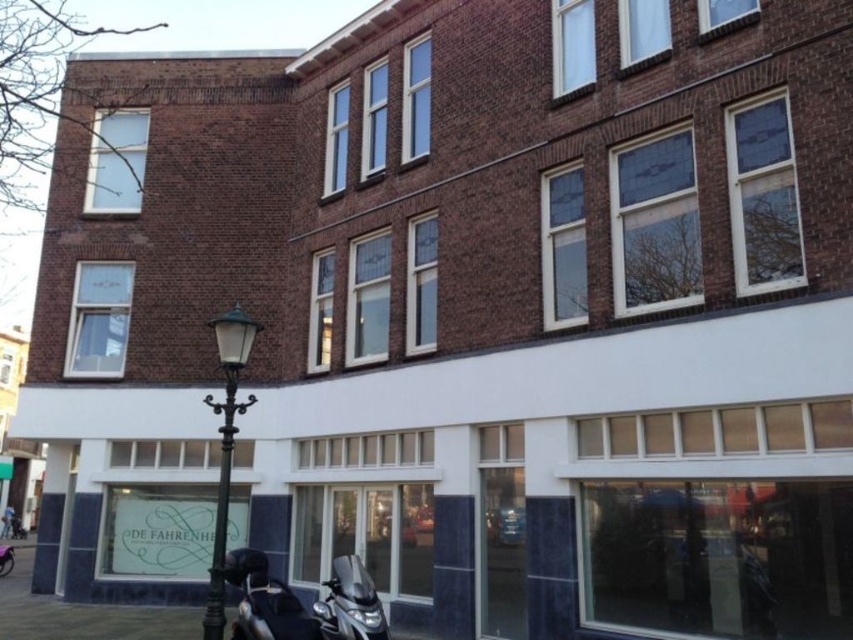
You are a delivery person standing at the entrance of the building. You need to park your motorcycle exactly 8 feet away from the black wrought iron streetlight at lower left. Can you park your shiny metallic motorcycle at lower center in the spot shown?

The black wrought iron streetlight at lower left is 7.76 feet away from the shiny metallic motorcycle at lower center. Since 7.76 feet is less than 8 feet, parking the shiny metallic motorcycle at lower center there would be too close to the streetlight. You need to move it further away by approximately 0.24 feet to meet the 8 feet requirement.

You are a delivery person who needs to park your shiny metallic motorcycle at lower center near the black wrought iron streetlight at lower left. Considering their heights, which object is shorter and would allow you to park without blocking the streetlight?

The black wrought iron streetlight at lower left is shorter than the shiny metallic motorcycle at lower center, so parking the motorcycle next to it won should not block the streetlight.

You are a delivery person who needs to park your motorcycle between the shiny black motorcycle at lower left and the shiny metallic motorcycle at lower center. Can you fit your motorcycle in the space between them?

The shiny black motorcycle at lower left is bigger than the shiny metallic motorcycle at lower center. Therefore, the space between them may be sufficient for your motorcycle, but the exact fit depends on the size of your motorcycle compared to the smaller shiny metallic motorcycle at lower center.